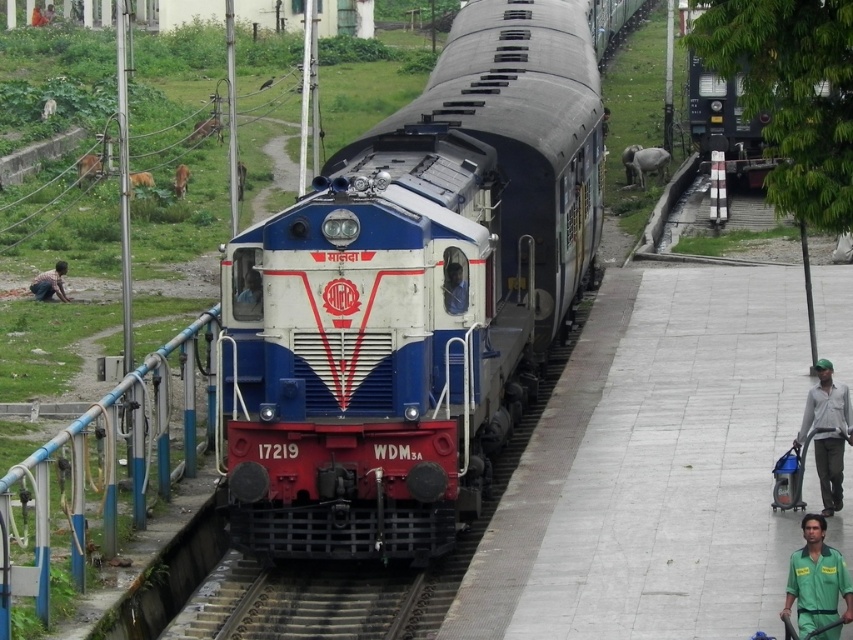
Question: Is blue painted metal railing at lower left to the right of green fabric shirt at right from the viewer's perspective?

Choices:
 (A) yes
 (B) no

Answer: (B)

Question: Is metallic helmet at center bigger than green fabric person at lower right?

Choices:
 (A) no
 (B) yes

Answer: (A)

Question: Which is nearer to the smooth concrete train track at center?

Choices:
 (A) green uniform at lower right
 (B) brown skin person at lower left
 (C) green fabric shirt at right

Answer: (C)

Question: Which of the following is the farthest from the observer?

Choices:
 (A) (453, 310)
 (B) (183, 618)
 (C) (241, 292)
 (D) (834, 461)

Answer: (C)

Question: Which of the following is the farthest from the observer?

Choices:
 (A) (45, 20)
 (B) (57, 260)

Answer: (A)

Question: From the image, what is the correct spatial relationship of metallic blue train at center in relation to metallic helmet at center?

Choices:
 (A) below
 (B) above

Answer: (B)